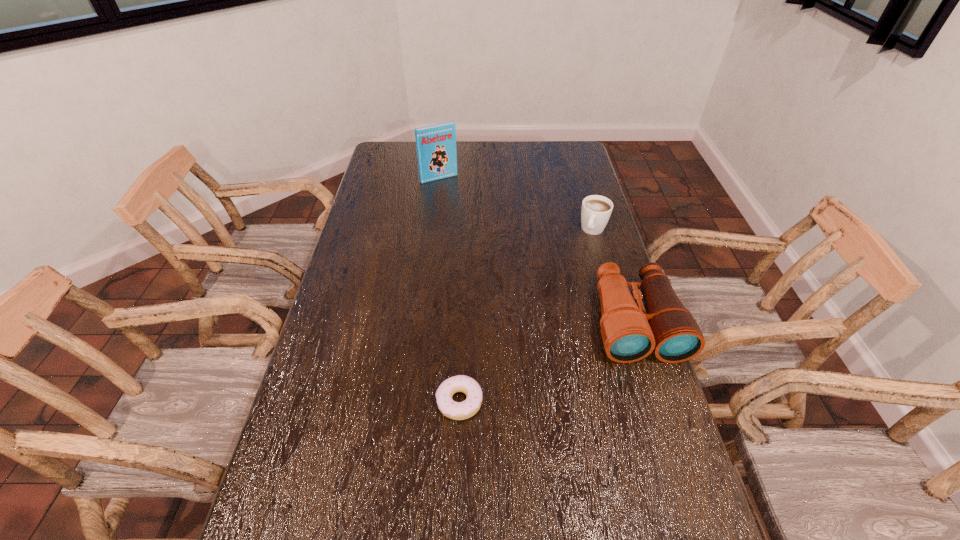
Where is `vacant space at the right edge of the desktop`? This screenshot has width=960, height=540. vacant space at the right edge of the desktop is located at coordinates (573, 239).

Where is `vacant space at the far left corner of the desktop`? Image resolution: width=960 pixels, height=540 pixels. vacant space at the far left corner of the desktop is located at coordinates (398, 152).

The width and height of the screenshot is (960, 540). In the image, there is a desktop. Identify the location of vacant space at the far right corner. (582, 151).

At what (x,y) coordinates should I click in order to perform the action: click on blank area at the near right corner. Please return your answer as a coordinate pair (x, y). The image size is (960, 540). Looking at the image, I should click on 646,529.

Locate an element on the screen. unoccupied area between the book and the second nearest object is located at coordinates (537, 250).

I want to click on free space between the tallest object and the third farthest object, so click(537, 250).

Image resolution: width=960 pixels, height=540 pixels. I want to click on free space between the farthest object and the binoculars, so pos(537,250).

Image resolution: width=960 pixels, height=540 pixels. I want to click on free space between the book and the cappuccino, so click(516, 204).

Identify the location of vacant point located between the cappuccino and the farthest object. The image size is (960, 540). (516, 204).

This screenshot has height=540, width=960. What are the coordinates of `free space that is in between the second nearest object and the doughnut` in the screenshot? It's located at click(547, 362).